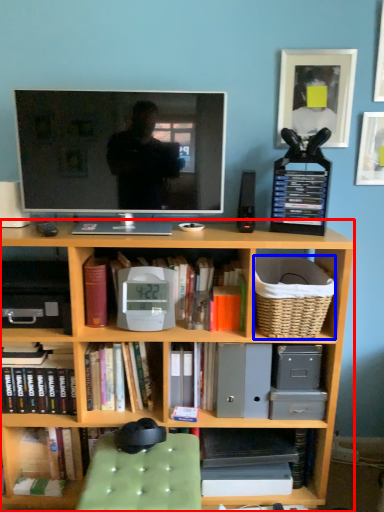
Question: Which object is closer to the camera taking this photo, bookcase (highlighted by a red box) or basket (highlighted by a blue box)?

Choices:
 (A) bookcase
 (B) basket

Answer: (A)